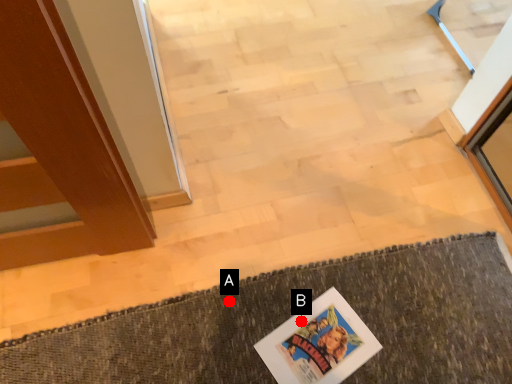
Question: Two points are circled on the image, labeled by A and B beside each circle. Which of the following is the closest to the observer?

Choices:
 (A) A is closer
 (B) B is closer

Answer: (B)